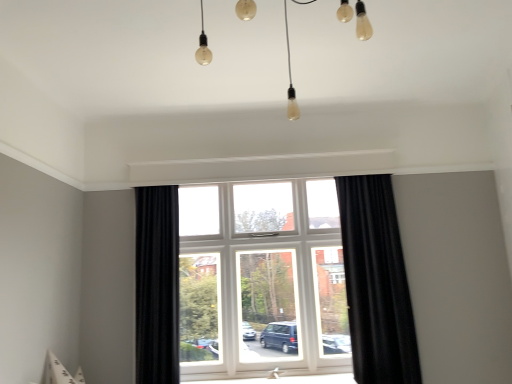
Question: Is black velvet curtain at center, placed as the second curtain when sorted from right to left, surrounded by white plastic window at center?

Choices:
 (A) yes
 (B) no

Answer: (B)

Question: Is white plastic window at center shorter than black velvet curtain at center, placed as the 1th curtain when sorted from left to right?

Choices:
 (A) yes
 (B) no

Answer: (A)

Question: Is white plastic window at center far away from black velvet curtain at center, placed as the 1th curtain when sorted from left to right?

Choices:
 (A) no
 (B) yes

Answer: (B)

Question: Is white plastic window at center taller than black velvet curtain at center, placed as the second curtain when sorted from right to left?

Choices:
 (A) yes
 (B) no

Answer: (B)

Question: Could you tell me if white plastic window at center is facing black velvet curtain at center, placed as the 1th curtain when sorted from left to right?

Choices:
 (A) no
 (B) yes

Answer: (A)

Question: From a real-world perspective, does white plastic window at center sit lower than black velvet curtain at center, placed as the 1th curtain when sorted from left to right?

Choices:
 (A) no
 (B) yes

Answer: (A)

Question: Considering the relative positions of white plastic window at center and black textured curtain at right, arranged as the 1th curtain when viewed from the right, in the image provided, is white plastic window at center in front of black textured curtain at right, arranged as the 1th curtain when viewed from the right,?

Choices:
 (A) yes
 (B) no

Answer: (B)

Question: Is white plastic window at center to the left of black textured curtain at right, arranged as the 1th curtain when viewed from the right, from the viewer's perspective?

Choices:
 (A) no
 (B) yes

Answer: (B)

Question: From a real-world perspective, does white plastic window at center stand above black textured curtain at right, arranged as the 1th curtain when viewed from the right?

Choices:
 (A) yes
 (B) no

Answer: (A)

Question: Does white plastic window at center appear on the right side of black textured curtain at right, the second curtain positioned from the left?

Choices:
 (A) yes
 (B) no

Answer: (B)

Question: Does white plastic window at center lie behind black textured curtain at right, the second curtain positioned from the left?

Choices:
 (A) yes
 (B) no

Answer: (A)

Question: Does white plastic window at center have a lesser width compared to black textured curtain at right, arranged as the 1th curtain when viewed from the right?

Choices:
 (A) yes
 (B) no

Answer: (A)

Question: Does black velvet curtain at center, placed as the second curtain when sorted from right to left, have a greater height compared to white plastic window at center?

Choices:
 (A) no
 (B) yes

Answer: (B)